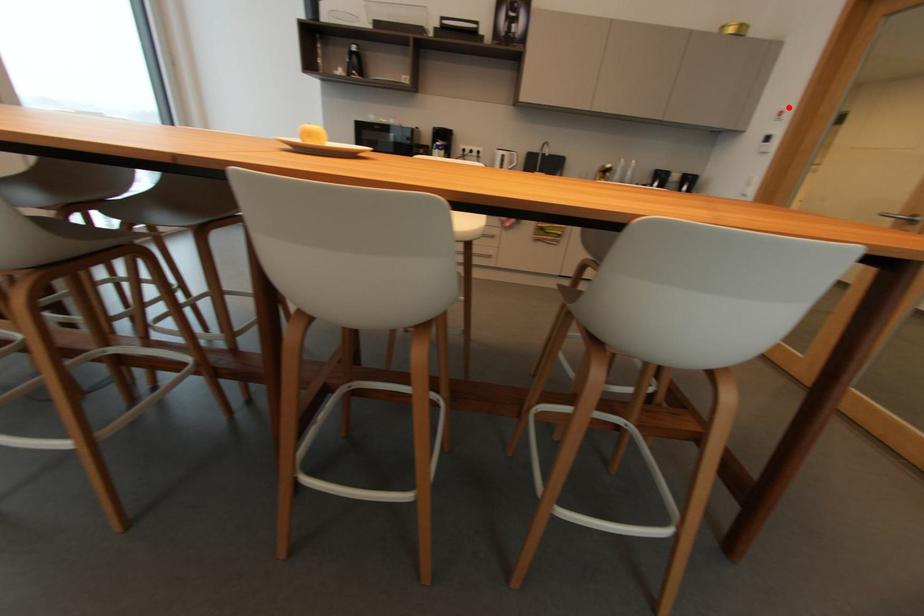
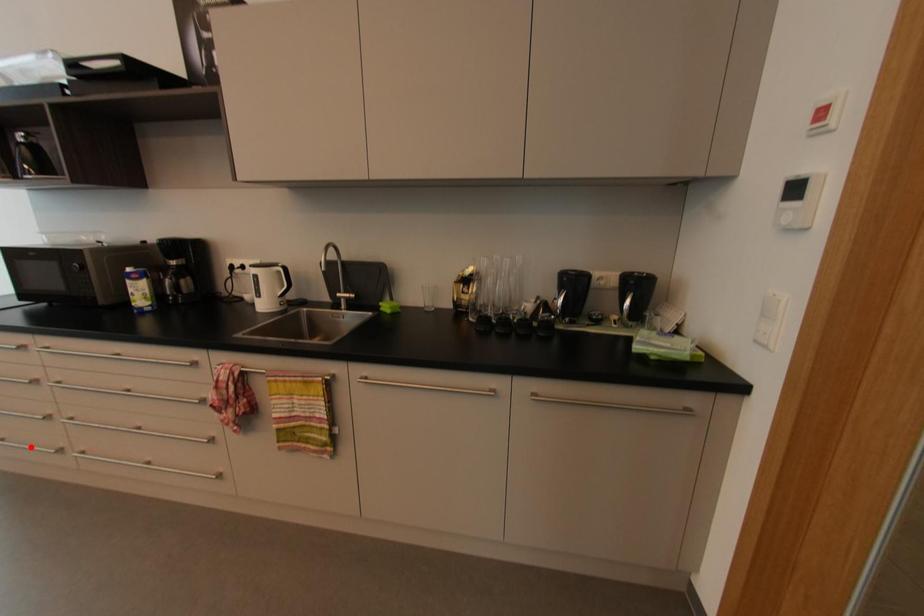
I am providing you with two images of the same scene from different viewpoints. A red point is marked on the first image and another point is marked on the second image. Are the points marked in image1 and image2 representing the same 3D position?

No